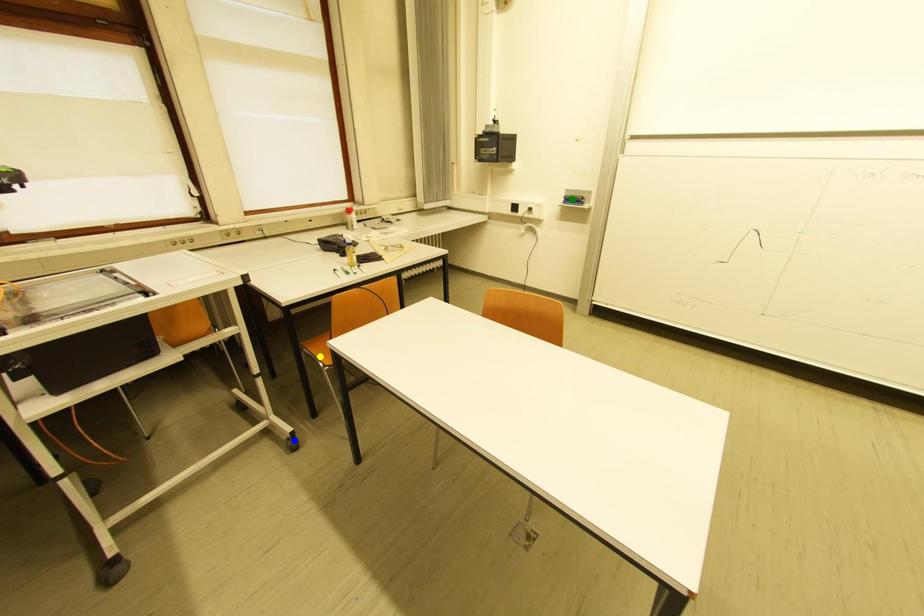
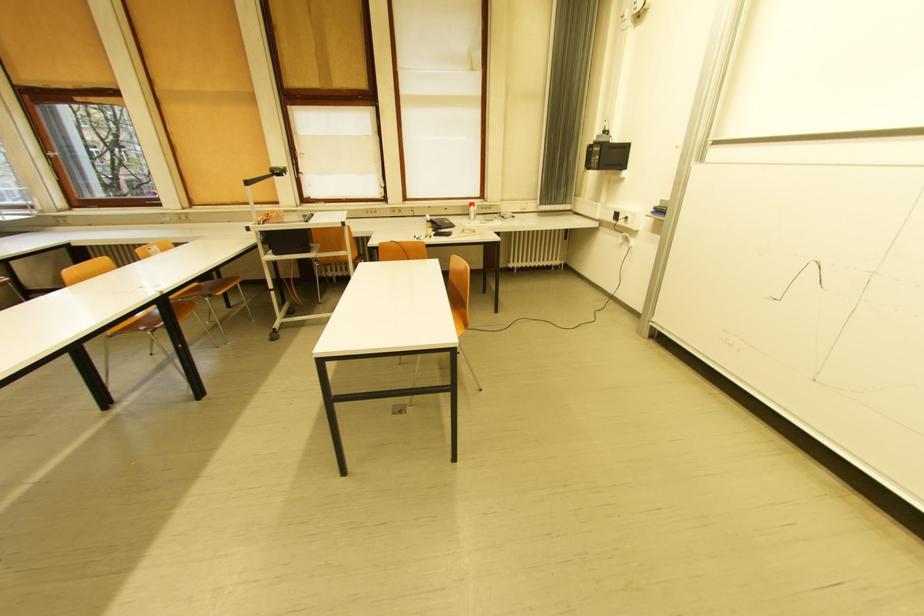
I am providing you with two images of the same scene from different viewpoints. Three points are marked in image1. Which point corresponds to a part or object that is occluded in image2?In image1, three points are marked. Which of them correspond to a part or object that is occluded in image2?Among the three points shown in image1, which one corresponds to a part or object that is no longer visible due to occlusion in image2?

Invisible in image2: yellow point, blue point.